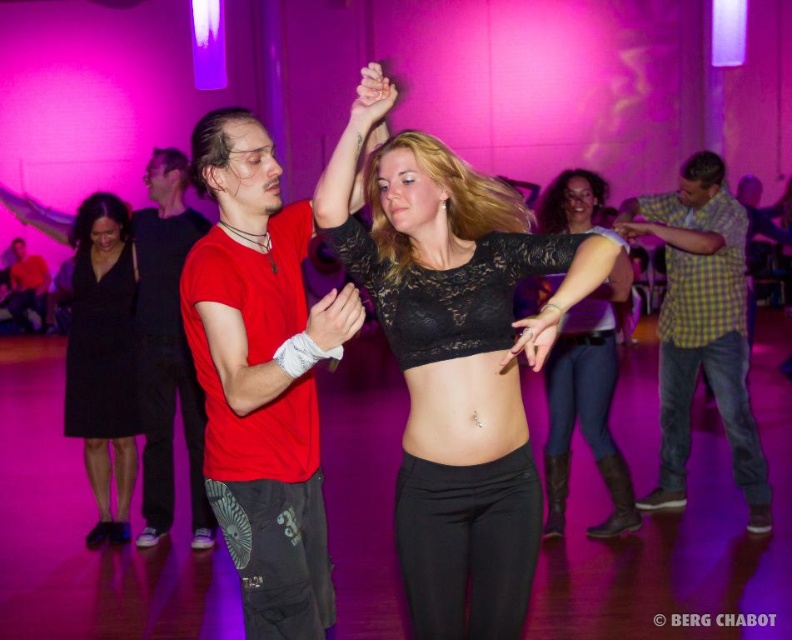
Question: Can you confirm if black satin dress at lower left is positioned below matte black shirt at left?

Choices:
 (A) yes
 (B) no

Answer: (A)

Question: Which of these objects is positioned closest to the red shirt at center?

Choices:
 (A) matte black shirt at left
 (B) black lace crop top at center

Answer: (B)

Question: Which point is farther to the camera?

Choices:
 (A) (204, 317)
 (B) (6, 308)
 (C) (99, 355)

Answer: (B)

Question: From the image, what is the correct spatial relationship of black lace crop top at center in relation to matte red t-shirt at center?

Choices:
 (A) right
 (B) left

Answer: (A)

Question: Which of the following is the farthest from the observer?

Choices:
 (A) (551, 460)
 (B) (478, 220)
 (C) (44, 272)
 (D) (93, 388)

Answer: (C)

Question: Observing the image, what is the correct spatial positioning of black lace crop top at center in reference to black satin dress at lower left?

Choices:
 (A) left
 (B) right

Answer: (B)